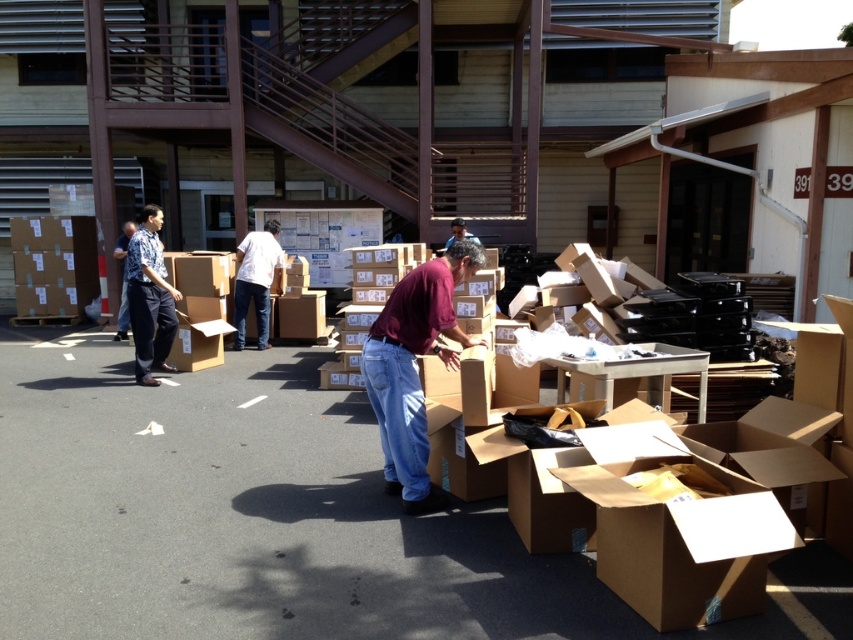
Question: Based on their relative distances, which object is farther from the blue shirt at left?

Choices:
 (A) dull blue shirt at left
 (B) jeans at center

Answer: (A)

Question: Is maroon shirt at center thinner than dull blue shirt at left?

Choices:
 (A) yes
 (B) no

Answer: (B)

Question: Is jeans at center smaller than matte brown shirt at center?

Choices:
 (A) yes
 (B) no

Answer: (B)

Question: Among these points, which one is farthest from the camera?

Choices:
 (A) click(x=451, y=243)
 (B) click(x=126, y=243)

Answer: (B)

Question: Among these objects, which one is farthest from the camera?

Choices:
 (A) blue shirt at left
 (B) matte brown shirt at center
 (C) maroon shirt at center
 (D) dull blue shirt at left

Answer: (B)

Question: Is maroon shirt at center thinner than dull blue shirt at left?

Choices:
 (A) no
 (B) yes

Answer: (A)